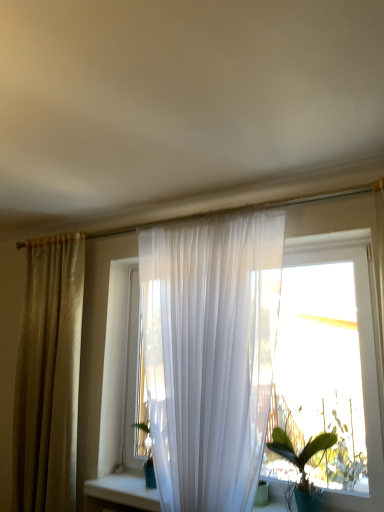
Question: Does green glossy leafy plant at lower right appear on the right side of matte beige curtain at left?

Choices:
 (A) no
 (B) yes

Answer: (B)

Question: Is green glossy leafy plant at lower right next to matte beige curtain at left and touching it?

Choices:
 (A) no
 (B) yes

Answer: (A)

Question: From the image's perspective, would you say green glossy leafy plant at lower right is shown under matte beige curtain at left?

Choices:
 (A) no
 (B) yes

Answer: (B)

Question: Would you say matte beige curtain at left is part of green glossy leafy plant at lower right's contents?

Choices:
 (A) no
 (B) yes

Answer: (A)

Question: Does green glossy leafy plant at lower right have a greater width compared to matte beige curtain at left?

Choices:
 (A) yes
 (B) no

Answer: (B)

Question: Choose the correct answer: Is translucent white curtain at center inside green glossy leafy plant at lower right or outside it?

Choices:
 (A) outside
 (B) inside

Answer: (A)

Question: Is translucent white curtain at center wider or thinner than green glossy leafy plant at lower right?

Choices:
 (A) thin
 (B) wide

Answer: (A)

Question: From a real-world perspective, is translucent white curtain at center physically located above or below green glossy leafy plant at lower right?

Choices:
 (A) below
 (B) above

Answer: (B)

Question: Is point (370, 218) positioned closer to the camera than point (321, 456)?

Choices:
 (A) farther
 (B) closer

Answer: (B)

Question: Based on their sizes in the image, would you say translucent white curtain at center is bigger or smaller than matte beige curtain at left?

Choices:
 (A) big
 (B) small

Answer: (B)

Question: Is translucent white curtain at center taller or shorter than matte beige curtain at left?

Choices:
 (A) tall
 (B) short

Answer: (B)

Question: Considering their positions, is translucent white curtain at center located in front of or behind matte beige curtain at left?

Choices:
 (A) front
 (B) behind

Answer: (A)

Question: From the image's perspective, is translucent white curtain at center located above or below matte beige curtain at left?

Choices:
 (A) above
 (B) below

Answer: (A)

Question: Is point (322, 449) positioned closer to the camera than point (82, 392)?

Choices:
 (A) closer
 (B) farther

Answer: (A)

Question: Looking at their shapes, would you say green glossy leafy plant at lower right is wider or thinner than translucent white curtain at center?

Choices:
 (A) thin
 (B) wide

Answer: (B)